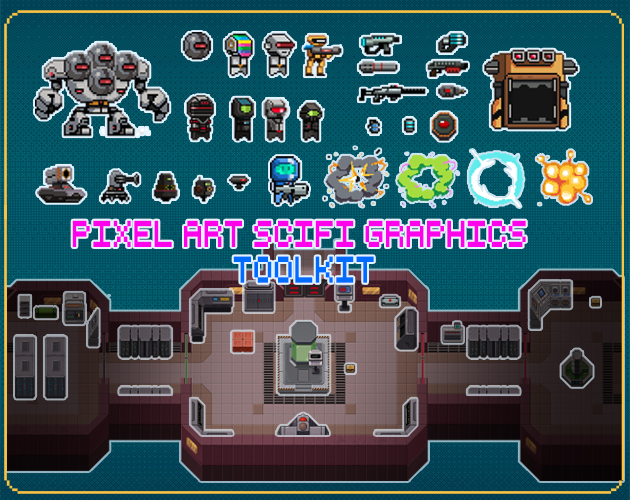
Find the location of `area to play games`. area to play games is located at coordinates (353, 393), (252, 393), (232, 379).